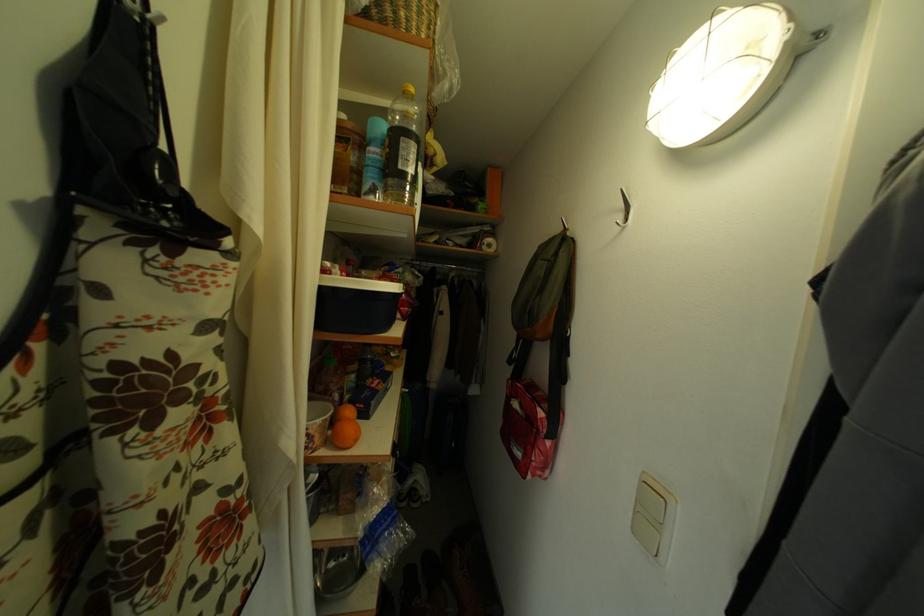
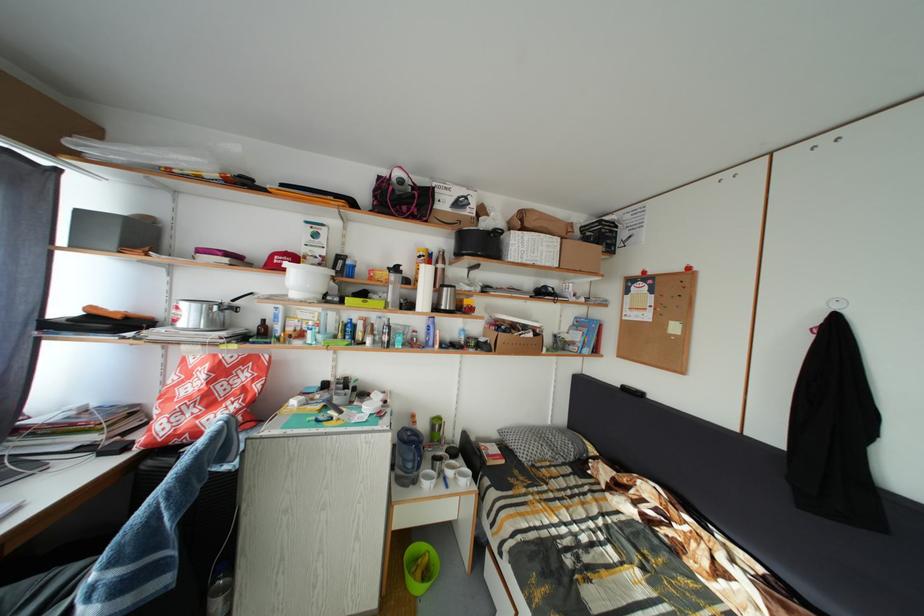
Question: The images are taken continuously from a first-person perspective. In which direction are you moving?

Choices:
 (A) Left
 (B) Right
 (C) Forward
 (D) Backward

Answer: (A)